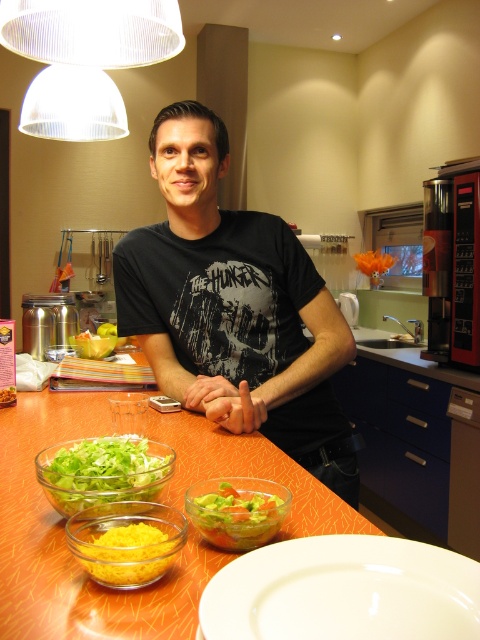
Can you confirm if green glass salad bowl at lower left is positioned to the right of translucent glass bowl at center?

Incorrect, green glass salad bowl at lower left is not on the right side of translucent glass bowl at center.

Does point (116, 483) lie behind point (241, 509)?

Yes, point (116, 483) is farther from viewer.

Locate an element on the screen. This screenshot has height=640, width=480. green glass salad bowl at lower left is located at coordinates (103, 472).

Consider the image. Who is lower down, orange glossy table at center or translucent glass bowl at center?

Positioned lower is translucent glass bowl at center.

Is the position of orange glossy table at center more distant than that of translucent glass bowl at center?

That is False.

Describe the element at coordinates (67, 547) in the screenshot. I see `orange glossy table at center` at that location.

Locate an element on the screen. The width and height of the screenshot is (480, 640). orange glossy table at center is located at coordinates (67, 547).

Is yellow matte bowl at lower left wider than green glass salad bowl at lower left?

No, yellow matte bowl at lower left is not wider than green glass salad bowl at lower left.

Consider the image. Between yellow matte bowl at lower left and green glass salad bowl at lower left, which one is positioned higher?

green glass salad bowl at lower left

Identify the location of yellow matte bowl at lower left. (127, 541).